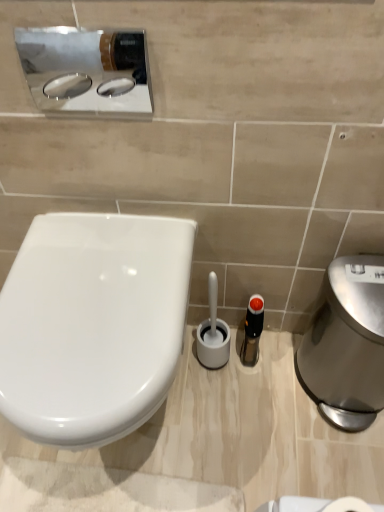
This screenshot has width=384, height=512. What do you see at coordinates (87, 71) in the screenshot?
I see `polished chrome sink at upper left` at bounding box center [87, 71].

What do you see at coordinates (93, 324) in the screenshot? This screenshot has height=512, width=384. I see `white glossy toilet at left` at bounding box center [93, 324].

The image size is (384, 512). What do you see at coordinates (347, 344) in the screenshot? I see `polished stainless steel hand dryer at right` at bounding box center [347, 344].

Identify the location of polished chrome sink at upper left. Image resolution: width=384 pixels, height=512 pixels. (87, 71).

Consider the image. Which is more to the left, polished stainless steel hand dryer at right or polished chrome sink at upper left?

From the viewer's perspective, polished chrome sink at upper left appears more on the left side.

Consider the image. Can you confirm if polished stainless steel hand dryer at right is taller than polished chrome sink at upper left?

Yes.

Considering the sizes of objects polished stainless steel hand dryer at right and polished chrome sink at upper left in the image provided, who is thinner, polished stainless steel hand dryer at right or polished chrome sink at upper left?

polished chrome sink at upper left is thinner.

Considering the positions of objects polished stainless steel hand dryer at right and white glossy toilet at left in the image provided, who is in front, polished stainless steel hand dryer at right or white glossy toilet at left?

white glossy toilet at left is closer to the camera.

Is polished stainless steel hand dryer at right turned away from white glossy toilet at left?

No, white glossy toilet at left is not at the back of polished stainless steel hand dryer at right.

Is polished stainless steel hand dryer at right smaller than white glossy toilet at left?

Yes.

In the scene shown: Considering the relative sizes of polished chrome sink at upper left and polished stainless steel hand dryer at right in the image provided, is polished chrome sink at upper left smaller than polished stainless steel hand dryer at right?

Correct, polished chrome sink at upper left occupies less space than polished stainless steel hand dryer at right.

Can you confirm if polished chrome sink at upper left is thinner than polished stainless steel hand dryer at right?

Indeed, polished chrome sink at upper left has a lesser width compared to polished stainless steel hand dryer at right.

This screenshot has width=384, height=512. Find the location of `hand dryer below the polished chrome sink at upper left (from the image's perspective)`. hand dryer below the polished chrome sink at upper left (from the image's perspective) is located at coordinates (347, 344).

Who is taller, polished chrome sink at upper left or polished stainless steel hand dryer at right?

polished stainless steel hand dryer at right.

How many degrees apart are the facing directions of white glossy toilet at left and translucent plastic bottle at center?

There is a 8.51-degree angle between the facing directions of white glossy toilet at left and translucent plastic bottle at center.

From the image's perspective, is white glossy toilet at left on top of translucent plastic bottle at center?

Yes, from the image's perspective, white glossy toilet at left is on top of translucent plastic bottle at center.

From a real-world perspective, is white glossy toilet at left physically below translucent plastic bottle at center?

No, from a real-world perspective, white glossy toilet at left is not below translucent plastic bottle at center.

Considering the sizes of objects white glossy toilet at left and translucent plastic bottle at center in the image provided, who is taller, white glossy toilet at left or translucent plastic bottle at center?

With more height is white glossy toilet at left.

Considering the sizes of objects translucent plastic bottle at center and polished stainless steel hand dryer at right in the image provided, who is smaller, translucent plastic bottle at center or polished stainless steel hand dryer at right?

translucent plastic bottle at center.

Considering the positions of objects translucent plastic bottle at center and polished stainless steel hand dryer at right in the image provided, who is more to the left, translucent plastic bottle at center or polished stainless steel hand dryer at right?

translucent plastic bottle at center.

From the image's perspective, does translucent plastic bottle at center appear lower than polished stainless steel hand dryer at right?

Incorrect, from the image's perspective, translucent plastic bottle at center is higher than polished stainless steel hand dryer at right.

From a real-world perspective, is translucent plastic bottle at center beneath polished stainless steel hand dryer at right?

Yes, from a real-world perspective, translucent plastic bottle at center is below polished stainless steel hand dryer at right.

Identify the location of toiletry below the white glossy toilet at left (from a real-world perspective). (252, 330).

From the image's perspective, is translucent plastic bottle at center above or below white glossy toilet at left?

translucent plastic bottle at center is situated lower than white glossy toilet at left in the image.

Based on their positions, is translucent plastic bottle at center located to the left or right of white glossy toilet at left?

Clearly, translucent plastic bottle at center is on the right of white glossy toilet at left in the image.

From the image's perspective, is polished chrome sink at upper left below translucent plastic bottle at center?

No.

Is polished chrome sink at upper left positioned with its back to translucent plastic bottle at center?

No, polished chrome sink at upper left is not facing the opposite direction of translucent plastic bottle at center.

Is polished chrome sink at upper left positioned far away from translucent plastic bottle at center?

No.

Image resolution: width=384 pixels, height=512 pixels. In order to click on sink that appears on the left of translucent plastic bottle at center in this screenshot , I will do `click(87, 71)`.

Identify the location of sink lying on the left of polished stainless steel hand dryer at right. The width and height of the screenshot is (384, 512). (87, 71).

In order to click on hand dryer on the right of white glossy toilet at left in this screenshot , I will do `click(347, 344)`.

From the image, which object appears to be nearer to white glossy toilet at left, polished chrome sink at upper left or translucent plastic bottle at center?

polished chrome sink at upper left is closer to white glossy toilet at left.

When comparing their distances from white glossy toilet at left, does polished stainless steel hand dryer at right or polished chrome sink at upper left seem further?

polished stainless steel hand dryer at right is positioned further to the anchor white glossy toilet at left.

Looking at the image, which one is located further to polished chrome sink at upper left, polished stainless steel hand dryer at right or white glossy toilet at left?

polished stainless steel hand dryer at right lies further to polished chrome sink at upper left than the other object.

Considering their positions, is white glossy toilet at left positioned further to polished chrome sink at upper left than translucent plastic bottle at center?

translucent plastic bottle at center lies further to polished chrome sink at upper left than the other object.

Which object lies further to the anchor point white glossy toilet at left, polished stainless steel hand dryer at right or translucent plastic bottle at center?

The object further to white glossy toilet at left is polished stainless steel hand dryer at right.

Looking at this image, which object lies nearer to the anchor point translucent plastic bottle at center, polished stainless steel hand dryer at right or white glossy toilet at left?

polished stainless steel hand dryer at right lies closer to translucent plastic bottle at center than the other object.

From the image, which object appears to be nearer to translucent plastic bottle at center, polished chrome sink at upper left or white glossy toilet at left?

Based on the image, white glossy toilet at left appears to be nearer to translucent plastic bottle at center.

Considering their positions, is translucent plastic bottle at center positioned further to polished stainless steel hand dryer at right than polished chrome sink at upper left?

polished chrome sink at upper left is positioned further to the anchor polished stainless steel hand dryer at right.

Locate an element on the screen. This screenshot has width=384, height=512. sink between white glossy toilet at left and polished stainless steel hand dryer at right from left to right is located at coordinates (87, 71).

You are a GUI agent. You are given a task and a screenshot of the screen. Output one action in this format:
    pyautogui.click(x=<x>, y=<y>)
    Task: Click on the toiletry that lies between polished chrome sink at upper left and polished stainless steel hand dryer at right from top to bottom
    
    Given the screenshot: What is the action you would take?
    pyautogui.click(x=252, y=330)

I want to click on toiletry between white glossy toilet at left and polished stainless steel hand dryer at right, so click(x=252, y=330).

Locate an element on the screen. This screenshot has width=384, height=512. toilet between polished chrome sink at upper left and translucent plastic bottle at center vertically is located at coordinates (93, 324).